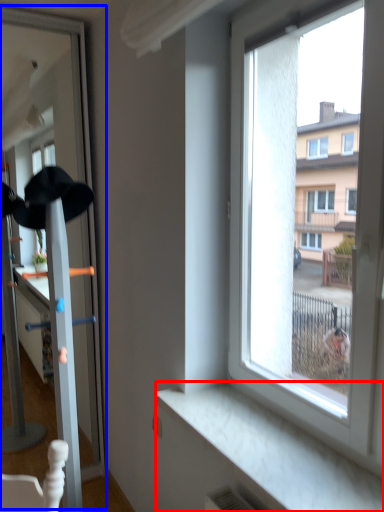
Question: Which point is further to the camera, window sill (highlighted by a red box) or screen door (highlighted by a blue box)?

Choices:
 (A) window sill
 (B) screen door

Answer: (B)